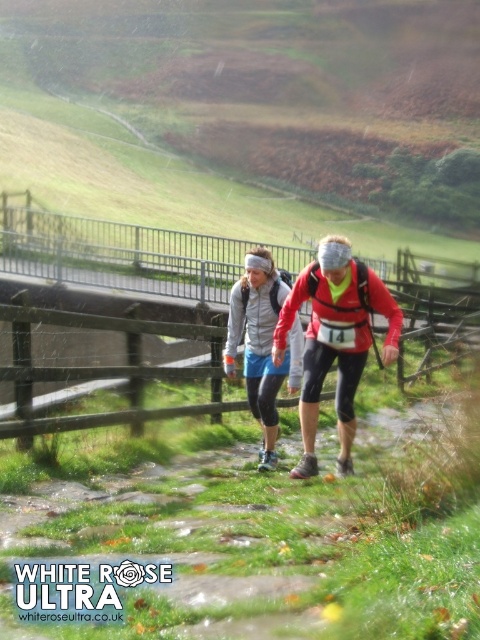
Question: Which of the following is the farthest from the observer?

Choices:
 (A) wooden at center
 (B) matte gray jacket at center

Answer: (A)

Question: Does wooden at center appear under matte red jacket at center?

Choices:
 (A) no
 (B) yes

Answer: (A)

Question: Does matte red jacket at center appear under matte gray jacket at center?

Choices:
 (A) no
 (B) yes

Answer: (A)

Question: Which of the following is the farthest from the observer?

Choices:
 (A) matte red jacket at center
 (B) matte gray jacket at center

Answer: (B)

Question: Considering the relative positions of wooden at center and matte red jacket at center in the image provided, where is wooden at center located with respect to matte red jacket at center?

Choices:
 (A) above
 (B) below

Answer: (A)

Question: Which object is farther from the camera taking this photo?

Choices:
 (A) wooden at center
 (B) matte red jacket at center

Answer: (A)